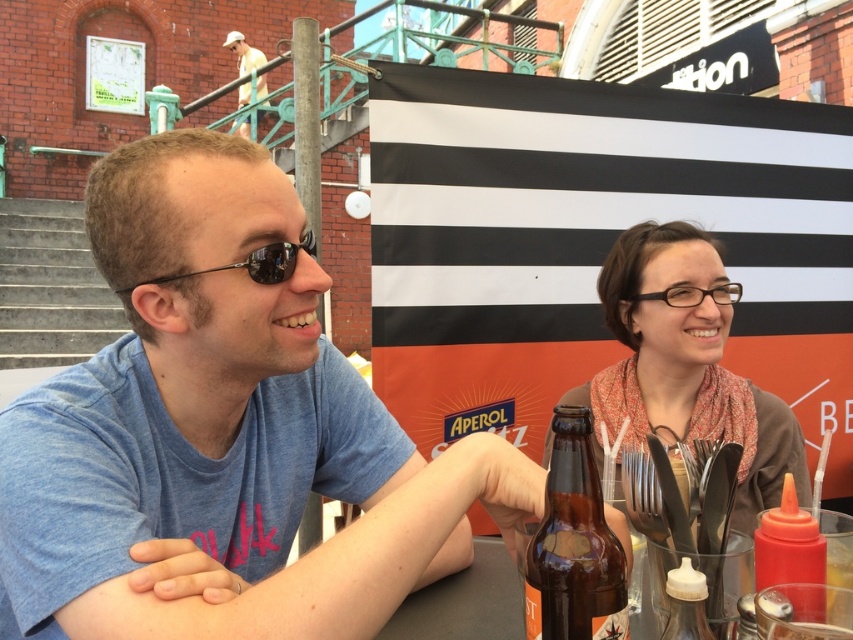
You are a waiter at this outdoor dining table. You need to place a new menu exactly at the coordinates point (x=788, y=545). However, there is an object already located there. What object is blocking the placement of the menu?

The object blocking the placement of the menu at point (x=788, y=545) is the matte plastic ketchup bottle at lower right.

You are a photographer at this outdoor dining scene. You need to decide which item to focus on first between the matte brown scarf at right and the brown glass bottle at center. Which one is bigger?

The matte brown scarf at right is larger in size than the brown glass bottle at center, so the photographer should focus on the matte brown scarf at right first.